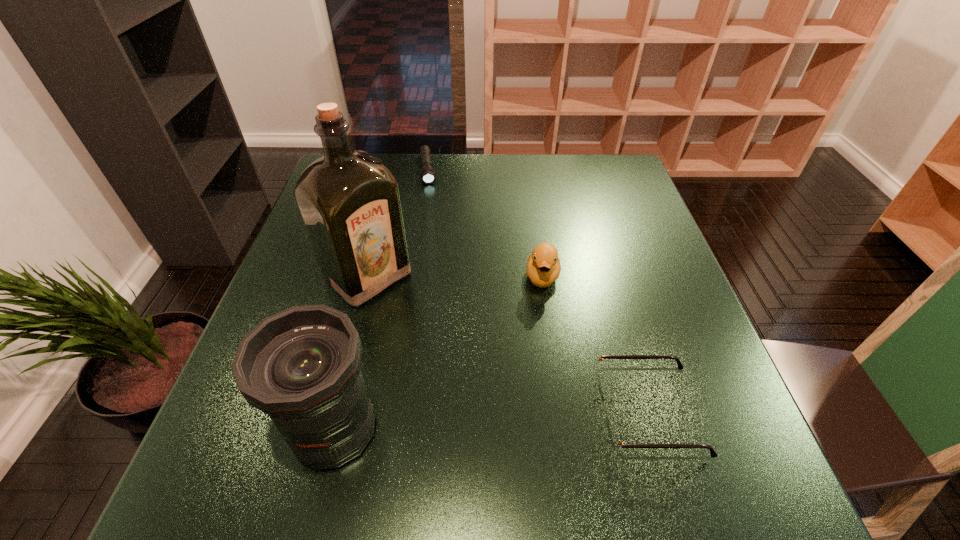
Identify the location of telephoto lens. The width and height of the screenshot is (960, 540). (301, 366).

Identify the location of the second shortest object. The image size is (960, 540). (616, 444).

Where is `spectacles`? Image resolution: width=960 pixels, height=540 pixels. spectacles is located at coordinates (616, 444).

This screenshot has width=960, height=540. I want to click on the fourth object from left to right, so click(x=543, y=267).

Identify the location of duckling. This screenshot has height=540, width=960. (543, 267).

Identify the location of liquor. The image size is (960, 540). (349, 201).

Image resolution: width=960 pixels, height=540 pixels. Find the location of `flashlight`. flashlight is located at coordinates (428, 175).

The image size is (960, 540). I want to click on the farthest object, so click(428, 175).

Locate an element on the screen. The height and width of the screenshot is (540, 960). free space located 0.320m on the right of the telephoto lens is located at coordinates (566, 430).

I want to click on vacant space located 0.060m at the hinge ends of the spectacles, so click(x=564, y=413).